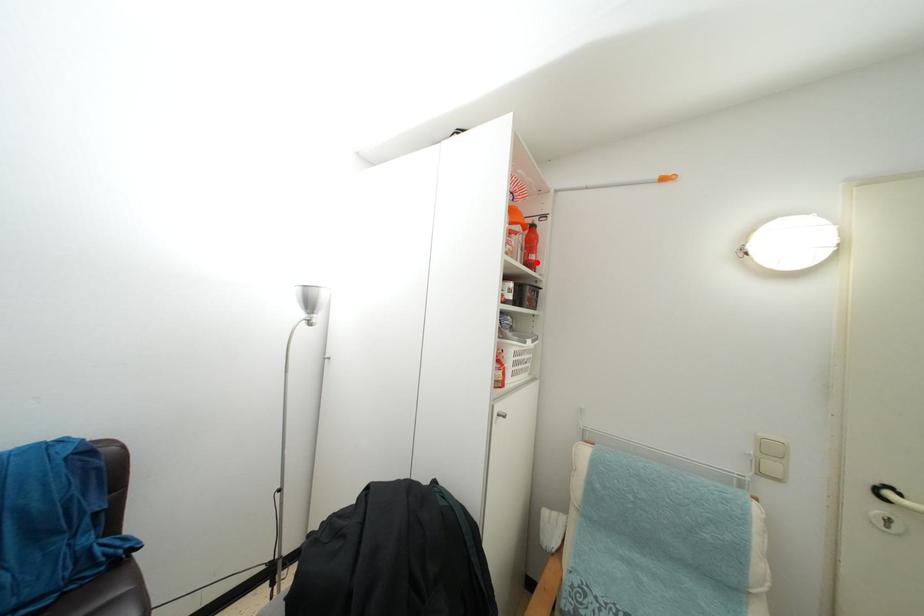
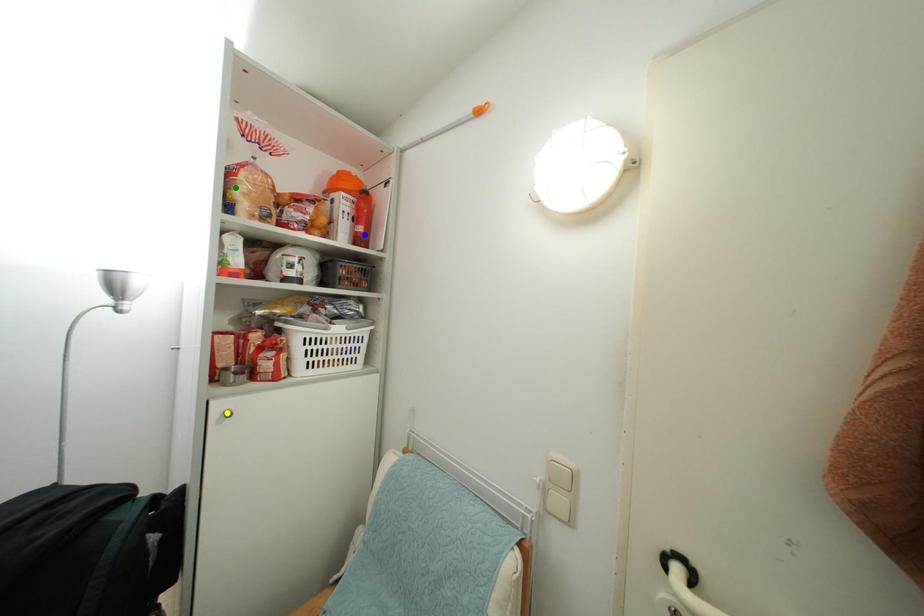
Question: I am providing you with two images of the same scene from different viewpoints. A red point is marked on the first image. You are given multiple points on the second image. Which spot in image 2 lines up with the point in image 1?

Choices:
 (A) blue point
 (B) yellow point
 (C) green point

Answer: (A)